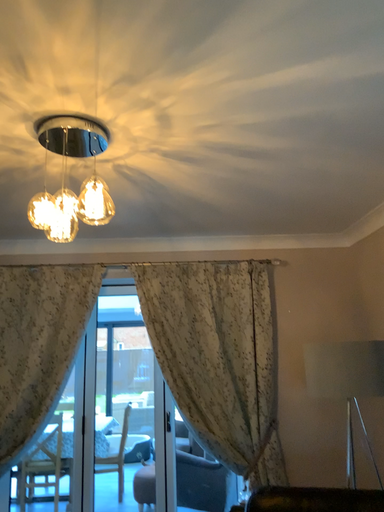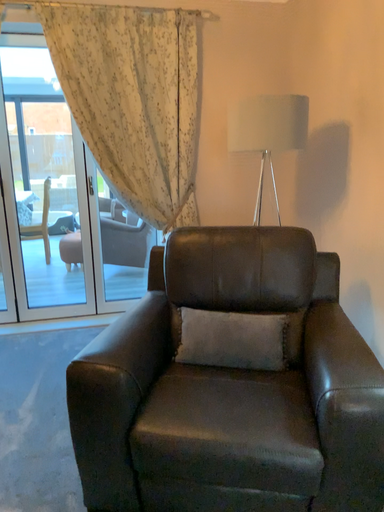
Question: Which way did the camera rotate in the video?

Choices:
 (A) rotated right
 (B) rotated left

Answer: (A)